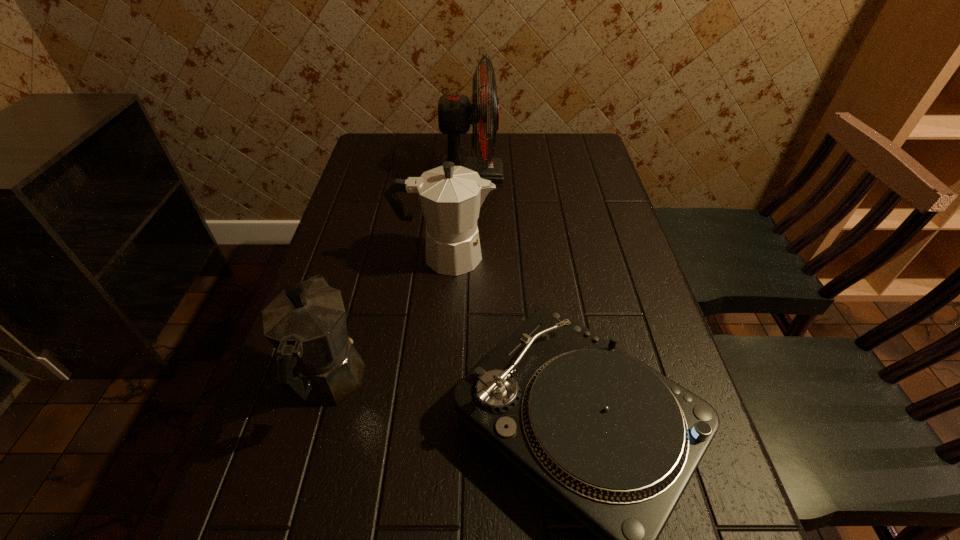
Locate an element on the screen. The height and width of the screenshot is (540, 960). the tallest object is located at coordinates [455, 112].

You are a GUI agent. You are given a task and a screenshot of the screen. Output one action in this format:
    pyautogui.click(x=<x>, y=<y>)
    Task: Click on the fan
    This screenshot has width=960, height=540.
    Given the screenshot: What is the action you would take?
    pyautogui.click(x=455, y=112)

The image size is (960, 540). Find the location of `the second farthest object`. the second farthest object is located at coordinates (451, 196).

Find the location of `the right coffeepot`. the right coffeepot is located at coordinates (451, 196).

This screenshot has width=960, height=540. Identify the location of the leftmost object. (317, 363).

In order to click on the left coffeepot in this screenshot , I will do `click(317, 363)`.

Where is `vacant space located 0.080m on the front-facing side of the tallest object`? vacant space located 0.080m on the front-facing side of the tallest object is located at coordinates (529, 173).

Where is `vacant area situated at the spout of the third nearest object`? vacant area situated at the spout of the third nearest object is located at coordinates (534, 256).

This screenshot has height=540, width=960. What are the coordinates of `blank area located 0.170m on the pouring side of the left coffeepot` in the screenshot? It's located at (357, 280).

Where is `free spot located 0.060m on the pouring side of the left coffeepot`? free spot located 0.060m on the pouring side of the left coffeepot is located at coordinates (348, 315).